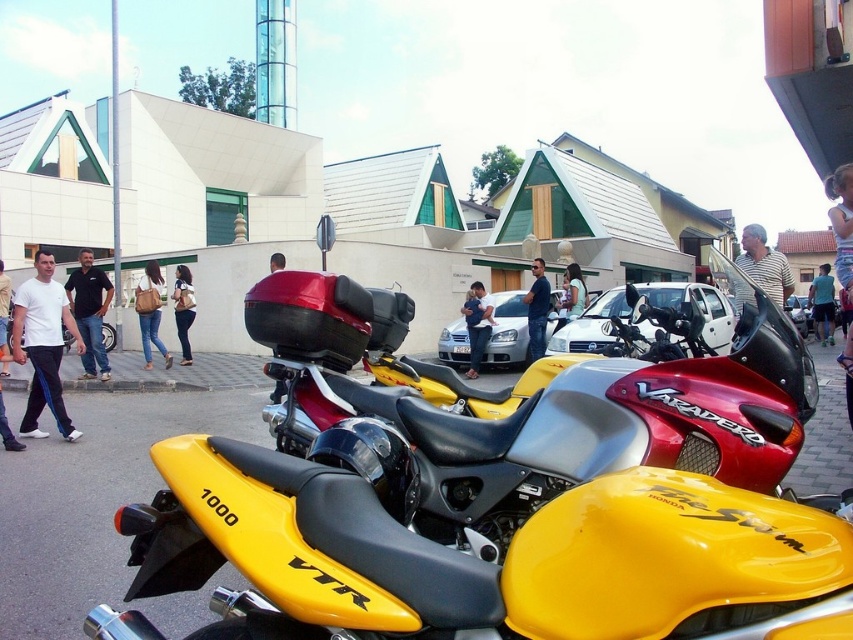
Question: Among these points, which one is farthest from the camera?

Choices:
 (A) (544, 285)
 (B) (743, 253)
 (C) (277, 259)

Answer: (C)

Question: Based on their relative distances, which object is farther from the light blue jeans at center?

Choices:
 (A) metallic silver motorcycle at center
 (B) yellow glossy motorcycle at center
 (C) light blue denim jeans at center
 (D) dark blue shirt at center

Answer: (B)

Question: In this image, where is matte gray shirt at center located relative to brown leather bag at center?

Choices:
 (A) right
 (B) left

Answer: (A)

Question: Is black shirt at center below light blue jeans at center?

Choices:
 (A) no
 (B) yes

Answer: (B)

Question: Does dark blue shirt at center lie behind light blue jeans at center?

Choices:
 (A) yes
 (B) no

Answer: (B)

Question: Among these points, which one is farthest from the camera?

Choices:
 (A) (828, 336)
 (B) (766, 273)
 (C) (846, 227)
 (D) (535, 362)

Answer: (A)